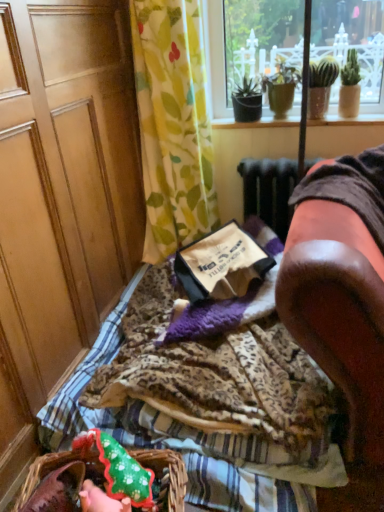
Question: Is brown leather armchair at right further to the viewer compared to leopard print fabric at center?

Choices:
 (A) yes
 (B) no

Answer: (B)

Question: From the image's perspective, is brown leather armchair at right located beneath leopard print fabric at center?

Choices:
 (A) no
 (B) yes

Answer: (A)

Question: Is leopard print fabric at center inside brown leather armchair at right?

Choices:
 (A) yes
 (B) no

Answer: (B)

Question: Is brown leather armchair at right taller than leopard print fabric at center?

Choices:
 (A) yes
 (B) no

Answer: (A)

Question: From the image's perspective, would you say brown leather armchair at right is positioned over leopard print fabric at center?

Choices:
 (A) yes
 (B) no

Answer: (A)

Question: Visually, is green fabric flower basket at lower left positioned to the left or to the right of wooden screen door at left?

Choices:
 (A) left
 (B) right

Answer: (B)

Question: Is green fabric flower basket at lower left bigger or smaller than wooden screen door at left?

Choices:
 (A) big
 (B) small

Answer: (B)

Question: Is green fabric flower basket at lower left inside or outside of wooden screen door at left?

Choices:
 (A) outside
 (B) inside

Answer: (A)

Question: Considering the positions of green fabric flower basket at lower left and wooden screen door at left in the image, is green fabric flower basket at lower left wider or thinner than wooden screen door at left?

Choices:
 (A) thin
 (B) wide

Answer: (A)

Question: Would you say leopard print fabric at center is inside or outside wooden screen door at left?

Choices:
 (A) outside
 (B) inside

Answer: (A)

Question: Is leopard print fabric at center wider or thinner than wooden screen door at left?

Choices:
 (A) thin
 (B) wide

Answer: (B)

Question: From their relative heights in the image, would you say leopard print fabric at center is taller or shorter than wooden screen door at left?

Choices:
 (A) tall
 (B) short

Answer: (B)

Question: From the image's perspective, is leopard print fabric at center located above or below wooden screen door at left?

Choices:
 (A) above
 (B) below

Answer: (B)

Question: Looking at their shapes, would you say wooden screen door at left is wider or thinner than brown paper bag at center?

Choices:
 (A) thin
 (B) wide

Answer: (B)

Question: From the image's perspective, is wooden screen door at left located above or below brown paper bag at center?

Choices:
 (A) below
 (B) above

Answer: (B)